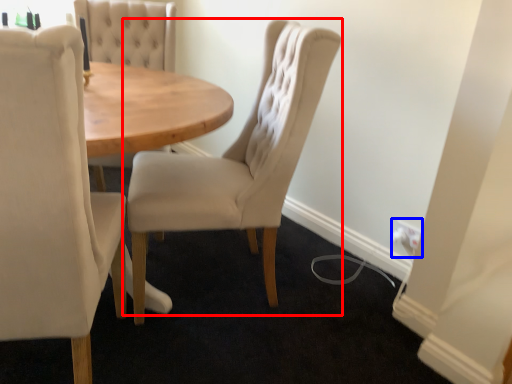
Question: Among these objects, which one is farthest to the camera, chair (highlighted by a red box) or electric outlet (highlighted by a blue box)?

Choices:
 (A) chair
 (B) electric outlet

Answer: (B)